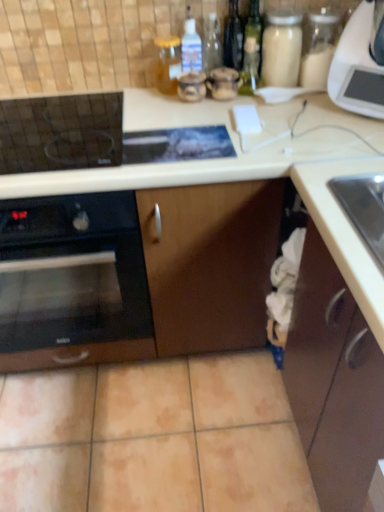
This screenshot has width=384, height=512. I want to click on free space on the front side of white plastic microwave at upper right, so [x=349, y=131].